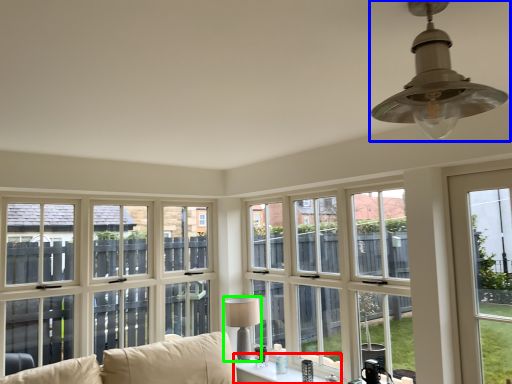
Question: Considering the real-world distances, which object is farthest from window (highlighted by a red box)? lamp (highlighted by a blue box) or lamp (highlighted by a green box)?

Choices:
 (A) lamp
 (B) lamp

Answer: (A)